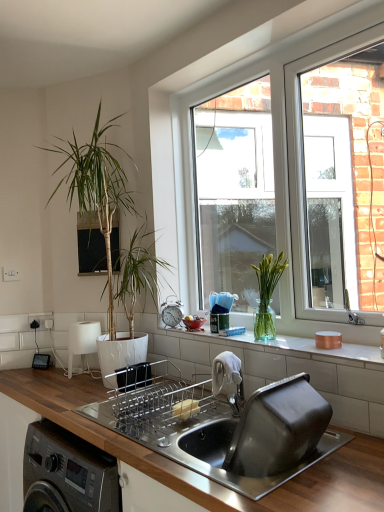
Question: Considering the relative positions of clear glass vase at center and green glass vase at window, placed as the second houseplant when sorted from left to right, in the image provided, is clear glass vase at center to the left of green glass vase at window, placed as the second houseplant when sorted from left to right, from the viewer's perspective?

Choices:
 (A) no
 (B) yes

Answer: (B)

Question: Can you confirm if clear glass vase at center is wider than green glass vase at window, which ranks as the 1th houseplant in right-to-left order?

Choices:
 (A) yes
 (B) no

Answer: (A)

Question: Can green glass vase at window, placed as the second houseplant when sorted from left to right, be found inside clear glass vase at center?

Choices:
 (A) no
 (B) yes

Answer: (A)

Question: From a real-world perspective, is clear glass vase at center under green glass vase at window, which ranks as the 1th houseplant in right-to-left order?

Choices:
 (A) yes
 (B) no

Answer: (A)

Question: Is clear glass vase at center oriented towards green glass vase at window, the first houseplant in the front-to-back sequence?

Choices:
 (A) yes
 (B) no

Answer: (B)

Question: From a real-world perspective, relative to stainless steel sink at center, is green leafy plant at left, arranged as the 1th houseplant when viewed from the left, vertically above or below?

Choices:
 (A) above
 (B) below

Answer: (A)

Question: Based on their positions, is green leafy plant at left, which is counted as the first houseplant, starting from the back, located to the left or right of stainless steel sink at center?

Choices:
 (A) left
 (B) right

Answer: (A)

Question: In the image, is green leafy plant at left, the second houseplant when ordered from front to back, positioned in front of or behind stainless steel sink at center?

Choices:
 (A) behind
 (B) front

Answer: (A)

Question: Is green leafy plant at left, the 2th houseplant in the right-to-left sequence, bigger or smaller than stainless steel sink at center?

Choices:
 (A) big
 (B) small

Answer: (A)

Question: Is white matte lamp at left, the 1th appliance positioned from the back, inside or outside of stainless steel sink at center?

Choices:
 (A) inside
 (B) outside

Answer: (B)

Question: Is point (92, 350) closer or farther from the camera than point (337, 432)?

Choices:
 (A) closer
 (B) farther

Answer: (B)

Question: In terms of height, does white matte lamp at left, acting as the 2th appliance starting from the front, look taller or shorter compared to stainless steel sink at center?

Choices:
 (A) short
 (B) tall

Answer: (A)

Question: Is white matte lamp at left, positioned as the 1th appliance in bottom-to-top order, wider or thinner than stainless steel sink at center?

Choices:
 (A) thin
 (B) wide

Answer: (A)

Question: Considering their positions, is silver metallic alarm clock at upper center, the first appliance viewed from the top, located in front of or behind clear glass window at center?

Choices:
 (A) behind
 (B) front

Answer: (A)

Question: In terms of size, does silver metallic alarm clock at upper center, the first appliance viewed from the right, appear bigger or smaller than clear glass window at center?

Choices:
 (A) big
 (B) small

Answer: (B)